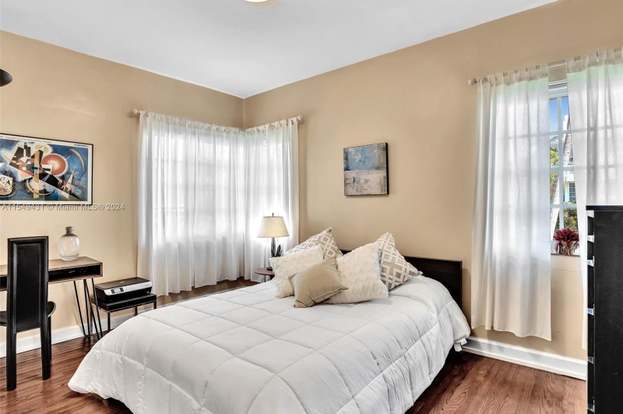
Locate an element on the screen. furniture is located at coordinates (21, 290), (64, 265), (115, 288), (123, 301), (445, 275), (612, 287), (265, 267).